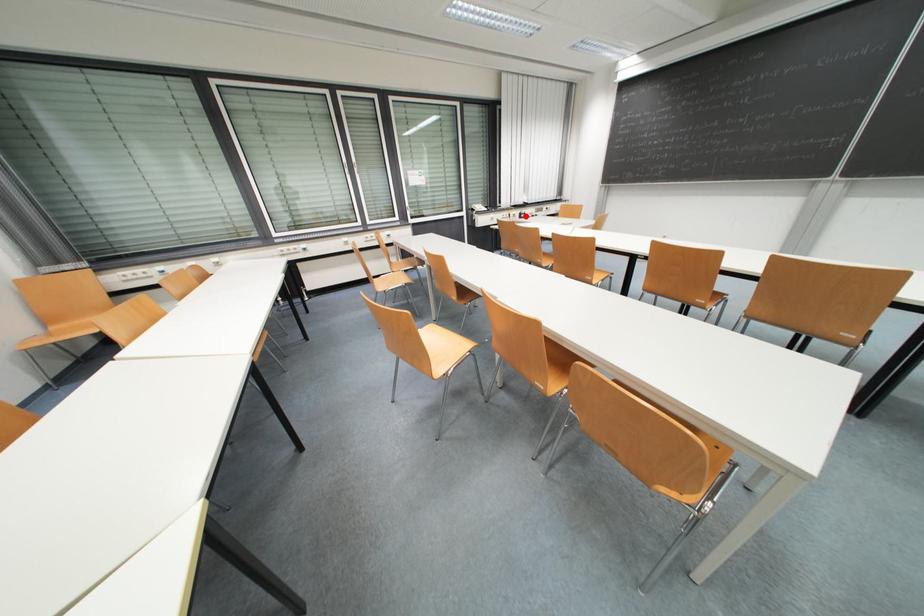
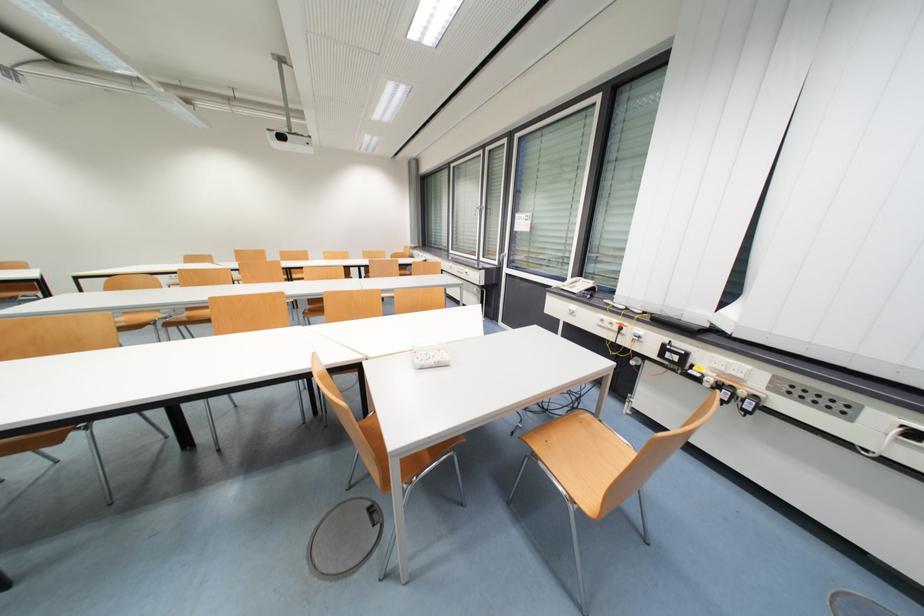
The point at the highlighted location is marked in the first image. Where is the corresponding point in the second image?

(671, 350)